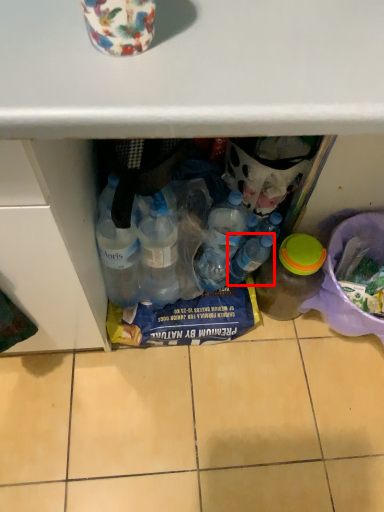
Question: From the image's perspective, where is bottle (annotated by the red box) located relative to bottle?

Choices:
 (A) below
 (B) above

Answer: (B)